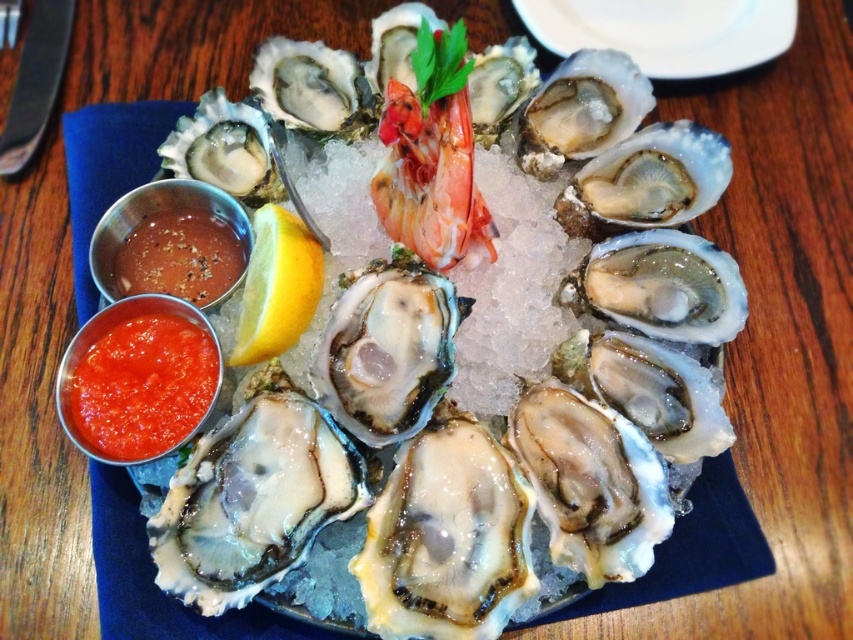
Can you confirm if smooth tomato sauce at lower left is smaller than smokey brown paste at lower left?

No, smooth tomato sauce at lower left is not smaller than smokey brown paste at lower left.

Between smooth tomato sauce at lower left and smokey brown paste at lower left, which one has less height?

smokey brown paste at lower left

Which is behind, point (199, 339) or point (213, 289)?

The point (213, 289) is more distant.

The height and width of the screenshot is (640, 853). What are the coordinates of `smooth tomato sauce at lower left` in the screenshot? It's located at (138, 378).

Is white shell oyster at center shorter than smokey brown paste at lower left?

In fact, white shell oyster at center may be taller than smokey brown paste at lower left.

Between point (630, 10) and point (125, 253), which one is positioned in front?

Point (125, 253)

The height and width of the screenshot is (640, 853). Find the location of `white shell oyster at center`. white shell oyster at center is located at coordinates (666, 32).

Find the location of `white shell oyster at center`. white shell oyster at center is located at coordinates (666, 32).

Describe the element at coordinates (666, 32) in the screenshot. I see `white shell oyster at center` at that location.

Which is below, white shell oyster at center or yellow matte lemon at center?

Positioned lower is yellow matte lemon at center.

Find the location of a particular element. This screenshot has width=853, height=640. white shell oyster at center is located at coordinates (666, 32).

Image resolution: width=853 pixels, height=640 pixels. In order to click on white shell oyster at center in this screenshot , I will do tap(666, 32).